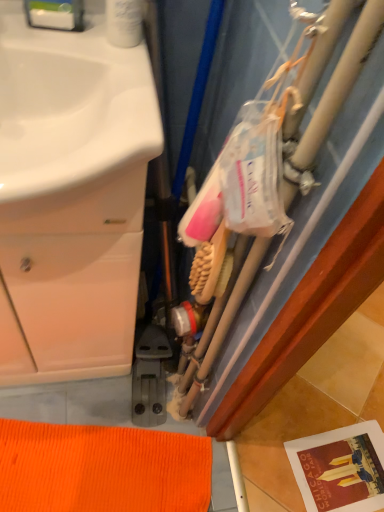
Image resolution: width=384 pixels, height=512 pixels. What do you see at coordinates (211, 267) in the screenshot? I see `wooden-bristled brush at center-right` at bounding box center [211, 267].

Where is `wooden-bristled brush at center-right`? The image size is (384, 512). wooden-bristled brush at center-right is located at coordinates pyautogui.click(x=211, y=267).

What do you see at coordinates (71, 198) in the screenshot? I see `white matte cabinet at left` at bounding box center [71, 198].

Where is `white matte cabinet at left`? The width and height of the screenshot is (384, 512). white matte cabinet at left is located at coordinates (71, 198).

Image resolution: width=384 pixels, height=512 pixels. Identify the location of wooden-bristled brush at center-right. (211, 267).

Can you confirm if white matte cabinet at left is positioned to the left of wooden-bristled brush at center-right?

Correct, you'll find white matte cabinet at left to the left of wooden-bristled brush at center-right.

Which object is closer to the camera taking this photo, white matte cabinet at left or wooden-bristled brush at center-right?

Positioned in front is white matte cabinet at left.

Between point (65, 244) and point (214, 257), which one is positioned behind?

The point (65, 244) is farther.

From the image's perspective, which is above, white matte cabinet at left or wooden-bristled brush at center-right?

From the image's view, white matte cabinet at left is above.

From a real-world perspective, who is located lower, white matte cabinet at left or wooden-bristled brush at center-right?

white matte cabinet at left, from a real-world perspective.

Based on the photo, which object is thinner, white matte cabinet at left or wooden-bristled brush at center-right?

wooden-bristled brush at center-right.

Which of these two, white matte cabinet at left or wooden-bristled brush at center-right, stands shorter?

wooden-bristled brush at center-right is shorter.

Considering the relative sizes of white matte cabinet at left and wooden-bristled brush at center-right in the image provided, is white matte cabinet at left bigger than wooden-bristled brush at center-right?

Indeed, white matte cabinet at left has a larger size compared to wooden-bristled brush at center-right.

Is white matte cabinet at left inside the boundaries of wooden-bristled brush at center-right, or outside?

white matte cabinet at left is not enclosed by wooden-bristled brush at center-right.

Can you see white matte cabinet at left touching wooden-bristled brush at center-right?

No, white matte cabinet at left is not beside wooden-bristled brush at center-right.

Consider the image. Could you tell me if white matte cabinet at left is facing wooden-bristled brush at center-right?

No, white matte cabinet at left is not facing towards wooden-bristled brush at center-right.

Looking at this image, how many degrees apart are the facing directions of white matte cabinet at left and wooden-bristled brush at center-right?

The facing directions of white matte cabinet at left and wooden-bristled brush at center-right are 83.6 degrees apart.

Where is `bathroom cabinet on the left of the wooden-bristled brush at center-right`? bathroom cabinet on the left of the wooden-bristled brush at center-right is located at coordinates (71, 198).

Considering the relative positions of wooden-bristled brush at center-right and white matte cabinet at left in the image provided, is wooden-bristled brush at center-right to the left of white matte cabinet at left from the viewer's perspective?

In fact, wooden-bristled brush at center-right is to the right of white matte cabinet at left.

Is wooden-bristled brush at center-right positioned in front of white matte cabinet at left?

No, the depth of wooden-bristled brush at center-right is greater than that of white matte cabinet at left.

Consider the image. Which is more distant, (224,286) or (17,31)?

The point (224,286) is farther from the camera.

From the image's perspective, which one is positioned lower, wooden-bristled brush at center-right or white matte cabinet at left?

wooden-bristled brush at center-right appears lower in the image.

From a real-world perspective, which object rests below the other?

In real-world perspective, white matte cabinet at left is lower.

Does wooden-bristled brush at center-right have a lesser width compared to white matte cabinet at left?

Indeed, wooden-bristled brush at center-right has a lesser width compared to white matte cabinet at left.

Considering the sizes of wooden-bristled brush at center-right and white matte cabinet at left in the image, is wooden-bristled brush at center-right taller or shorter than white matte cabinet at left?

In the image, wooden-bristled brush at center-right appears to be shorter than white matte cabinet at left.

Who is smaller, wooden-bristled brush at center-right or white matte cabinet at left?

wooden-bristled brush at center-right is smaller.

Is wooden-bristled brush at center-right not within white matte cabinet at left?

Absolutely, wooden-bristled brush at center-right is external to white matte cabinet at left.

Is wooden-bristled brush at center-right directly adjacent to white matte cabinet at left?

They are not placed beside each other.

Is wooden-bristled brush at center-right aimed at white matte cabinet at left?

No, wooden-bristled brush at center-right is not oriented towards white matte cabinet at left.

How much distance is there between wooden-bristled brush at center-right and white matte cabinet at left?

wooden-bristled brush at center-right and white matte cabinet at left are 10.94 inches apart from each other.

You are a GUI agent. You are given a task and a screenshot of the screen. Output one action in this format:
    pyautogui.click(x=<x>, y=<y>)
    Task: Click on the bathroom cabinet that appears in front of the wooden-bristled brush at center-right
    This screenshot has height=512, width=384.
    Given the screenshot: What is the action you would take?
    pyautogui.click(x=71, y=198)

Image resolution: width=384 pixels, height=512 pixels. Find the location of `bathroom cabinet that appears above the wooden-bristled brush at center-right (from the image's perspective)`. bathroom cabinet that appears above the wooden-bristled brush at center-right (from the image's perspective) is located at coordinates (71, 198).

What are the coordinates of `bathroom cabinet in front of the wooden-bristled brush at center-right` in the screenshot? It's located at (71, 198).